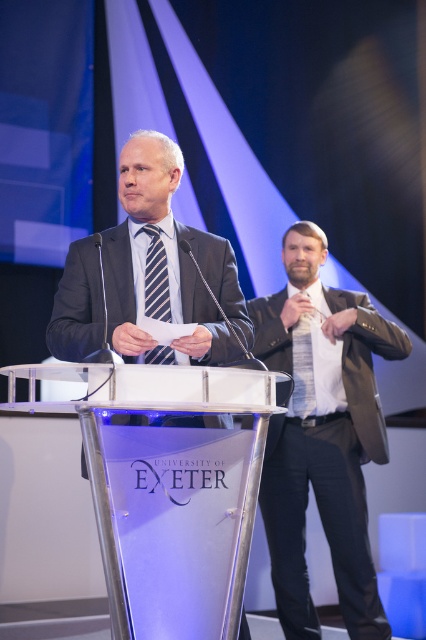
Question: Can you confirm if transparent acrylic podium at center is positioned to the left of striped fabric tie at center?

Choices:
 (A) yes
 (B) no

Answer: (B)

Question: Which point is farther to the camera?

Choices:
 (A) (281, 577)
 (B) (85, 372)

Answer: (A)

Question: Which point appears closest to the camera in this image?

Choices:
 (A) (308, 372)
 (B) (103, 499)
 (C) (149, 244)

Answer: (B)

Question: Does transparent acrylic podium at center have a greater width compared to matte black tie at right?

Choices:
 (A) yes
 (B) no

Answer: (A)

Question: Considering the relative positions of transparent acrylic podium at center and striped fabric tie at center in the image provided, where is transparent acrylic podium at center located with respect to striped fabric tie at center?

Choices:
 (A) below
 (B) above

Answer: (A)

Question: Which of the following is the farthest from the observer?

Choices:
 (A) (166, 358)
 (B) (299, 374)
 (C) (302, 312)

Answer: (B)